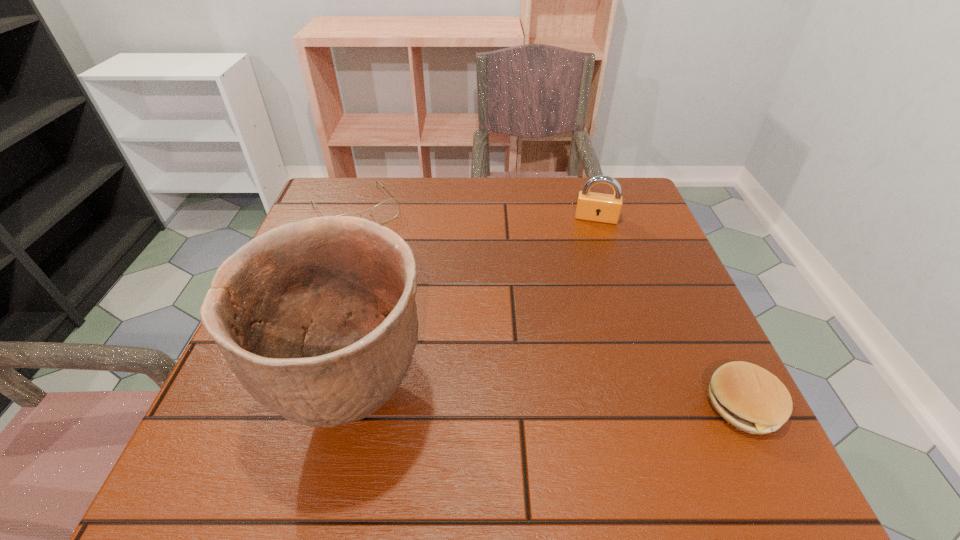
The width and height of the screenshot is (960, 540). I want to click on pottery, so click(x=317, y=319).

Locate an element on the screen. Image resolution: width=960 pixels, height=540 pixels. patty is located at coordinates (750, 398).

The height and width of the screenshot is (540, 960). I want to click on the second object from right to left, so click(x=591, y=206).

Where is `padlock`? padlock is located at coordinates (591, 206).

This screenshot has width=960, height=540. What are the coordinates of `spectacles` in the screenshot? It's located at (389, 209).

This screenshot has height=540, width=960. I want to click on blank space located on the back of the tallest object, so click(x=383, y=274).

This screenshot has width=960, height=540. Identify the location of free location located on the left of the rightmost object. (612, 405).

The width and height of the screenshot is (960, 540). I want to click on vacant position located 0.100m to unlock the padlock from the front, so coord(591,249).

The height and width of the screenshot is (540, 960). What are the coordinates of `free space located 0.260m to unlock the padlock from the front` in the screenshot? It's located at (588, 295).

Image resolution: width=960 pixels, height=540 pixels. What are the coordinates of `vacant space located 0.330m to unlock the padlock from the front` in the screenshot? It's located at (585, 319).